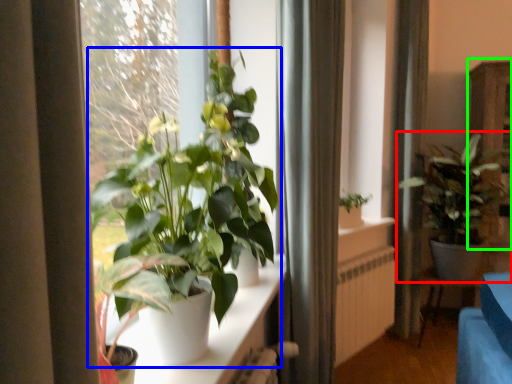
Question: Which object is positioned closest to houseplant (highlighted by a red box)? Select from houseplant (highlighted by a blue box) and dresser (highlighted by a green box).

Choices:
 (A) houseplant
 (B) dresser

Answer: (B)